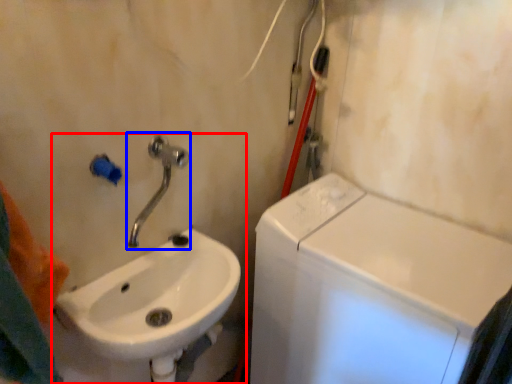
Question: Among these objects, which one is nearest to the camera, sink (highlighted by a red box) or tap (highlighted by a blue box)?

Choices:
 (A) sink
 (B) tap

Answer: (A)